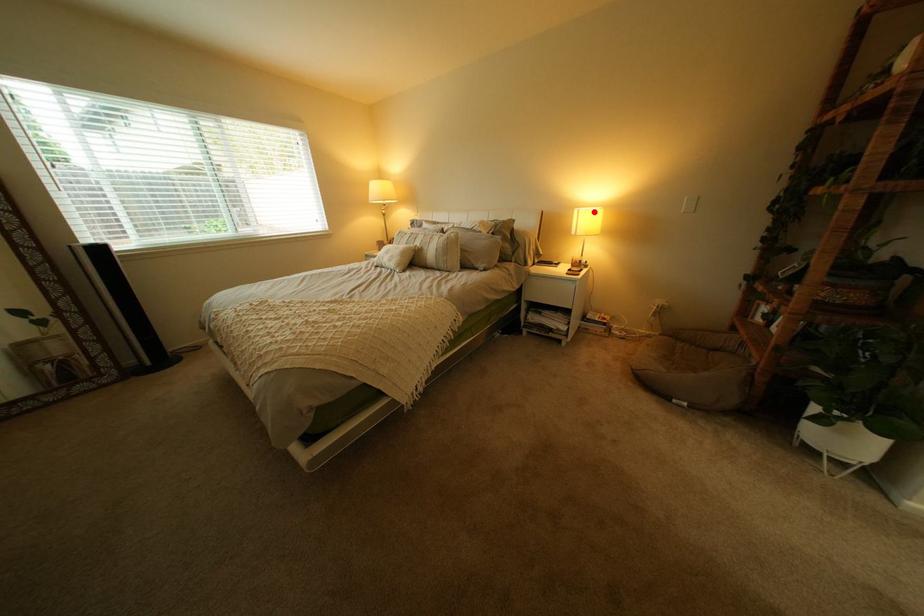
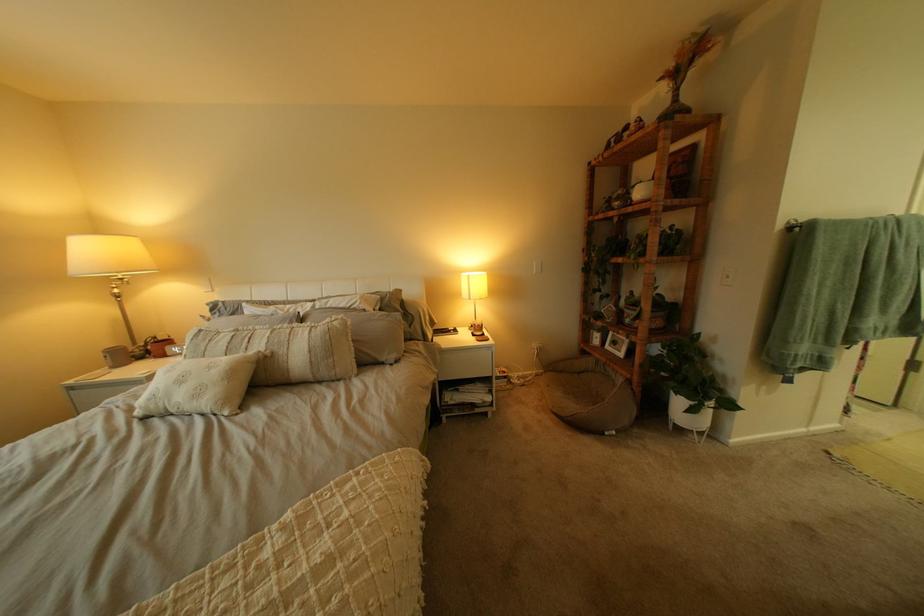
Where in the second image is the point corresponding to the highlighted location from the first image?

(483, 277)